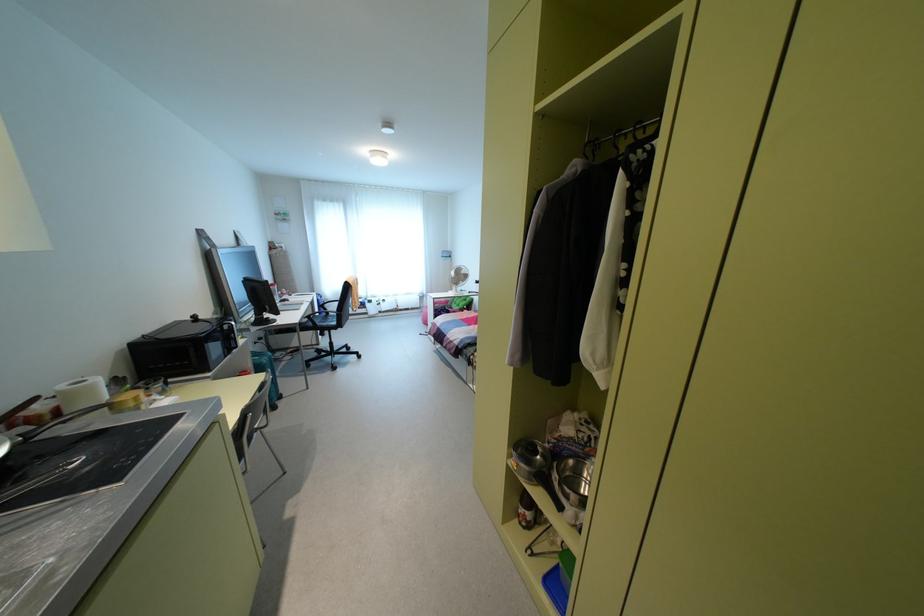
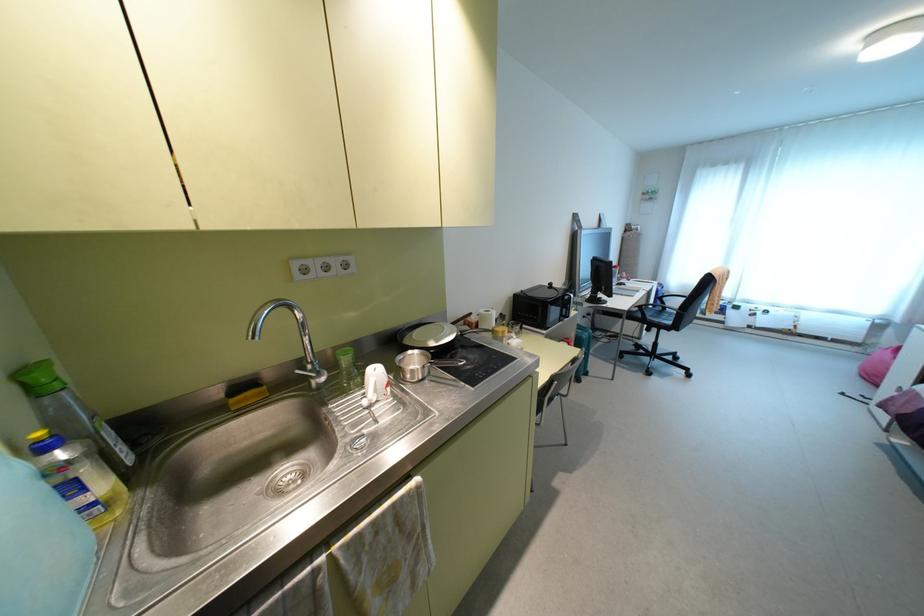
In the second image, find the point that corresponds to (241,341) in the first image.

(573, 313)